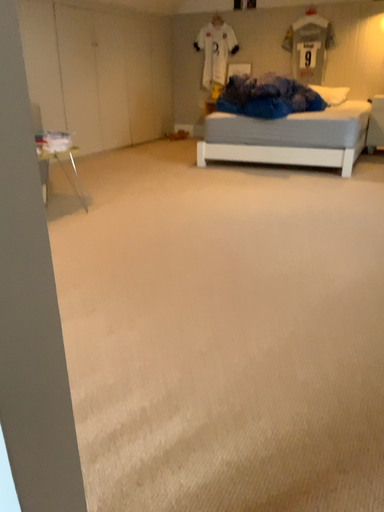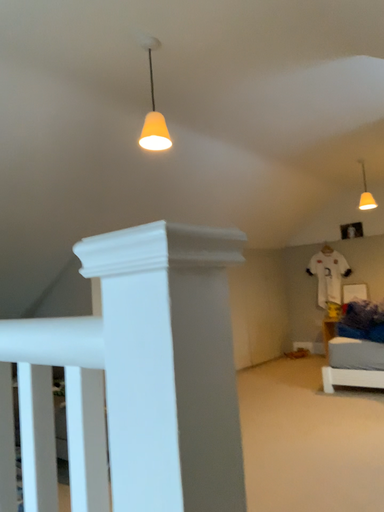
Question: Which way did the camera rotate in the video?

Choices:
 (A) rotated upward
 (B) rotated downward

Answer: (A)